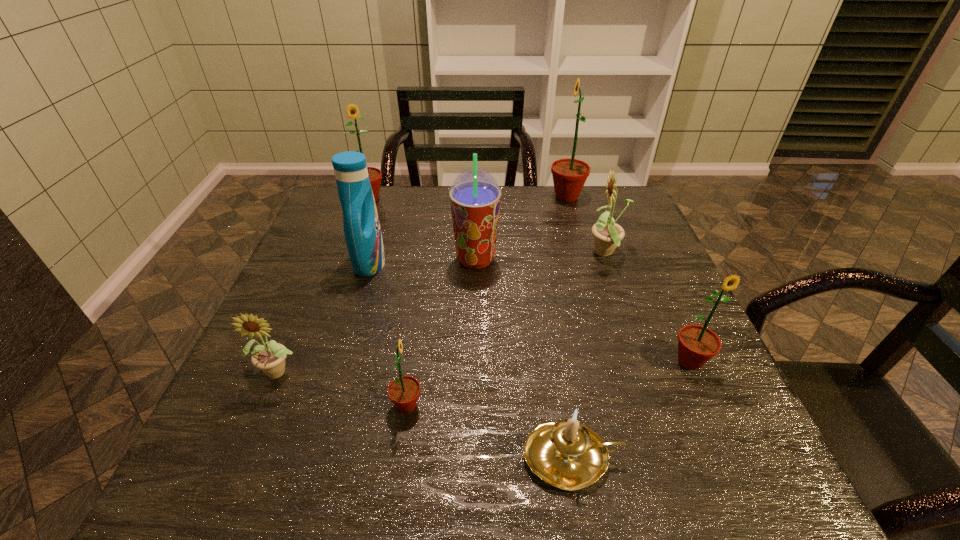
You are a GUI agent. You are given a task and a screenshot of the screen. Output one action in this format:
    pyautogui.click(x=<x>, y=<y>)
    Task: Click on the free point that satisfies the following two spatial constraints: 1. on the face of the tallest sunflower; 2. on the front-facing side of the left yellow sunflower
    This screenshot has width=960, height=540.
    Given the screenshot: What is the action you would take?
    pyautogui.click(x=616, y=370)